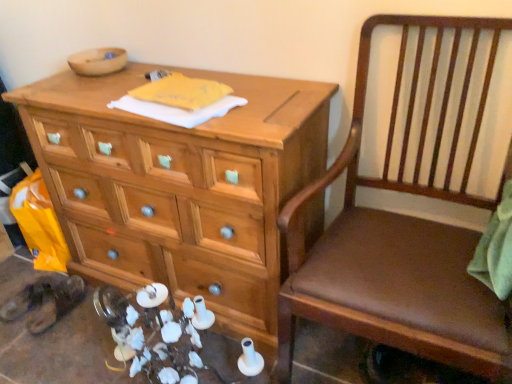
In order to face brown wood chair at right, should I rotate leftwards or rightwards?

Rotate your view right by about 20.165°.

What do you see at coordinates (384, 227) in the screenshot? I see `brown wood chair at right` at bounding box center [384, 227].

Where is `brown wood chair at right`? The width and height of the screenshot is (512, 384). brown wood chair at right is located at coordinates (384, 227).

Describe the element at coordinates (180, 187) in the screenshot. I see `natural wood chest of drawers at center` at that location.

Identify the location of natural wood chest of drawers at center. (x=180, y=187).

Identify the location of brown wood chair at right. (384, 227).

Is natural wood chest of drawers at center to the right of brown wood chair at right from the viewer's perspective?

Incorrect, natural wood chest of drawers at center is not on the right side of brown wood chair at right.

Does natural wood chest of drawers at center lie in front of brown wood chair at right?

That is False.

Which is less distant, [246,239] or [454,260]?

Point [454,260]

From the image's perspective, is natural wood chest of drawers at center located above or below brown wood chair at right?

natural wood chest of drawers at center is above brown wood chair at right.

From a real-world perspective, is natural wood chest of drawers at center located higher than brown wood chair at right?

No, from a real-world perspective, natural wood chest of drawers at center is not over brown wood chair at right

Considering the sizes of objects natural wood chest of drawers at center and brown wood chair at right in the image provided, who is thinner, natural wood chest of drawers at center or brown wood chair at right?

natural wood chest of drawers at center.

Does natural wood chest of drawers at center have a greater height compared to brown wood chair at right?

Incorrect, the height of natural wood chest of drawers at center is not larger of that of brown wood chair at right.

Based on their sizes in the image, would you say natural wood chest of drawers at center is bigger or smaller than brown wood chair at right?

Considering their sizes, natural wood chest of drawers at center takes up more space than brown wood chair at right.

Is natural wood chest of drawers at center positioned beyond the bounds of brown wood chair at right?

natural wood chest of drawers at center is positioned outside brown wood chair at right.

Looking at this image, is natural wood chest of drawers at center next to brown wood chair at right and touching it?

No, natural wood chest of drawers at center is not in contact with brown wood chair at right.

Is natural wood chest of drawers at center positioned with its back to brown wood chair at right?

No, natural wood chest of drawers at center's orientation is not away from brown wood chair at right.

How different are the orientations of natural wood chest of drawers at center and brown wood chair at right in degrees?

2.28e-05 degrees separate the facing orientations of natural wood chest of drawers at center and brown wood chair at right.

From the picture: How distant is natural wood chest of drawers at center from brown wood chair at right?

natural wood chest of drawers at center and brown wood chair at right are 16.39 inches apart.

This screenshot has width=512, height=384. Find the location of `chest of drawers that is on the left side of brown wood chair at right`. chest of drawers that is on the left side of brown wood chair at right is located at coordinates click(x=180, y=187).

Considering the positions of objects brown wood chair at right and natural wood chest of drawers at center in the image provided, who is more to the left, brown wood chair at right or natural wood chest of drawers at center?

From the viewer's perspective, natural wood chest of drawers at center appears more on the left side.

Which object is closer to the camera taking this photo, brown wood chair at right or natural wood chest of drawers at center?

Positioned in front is brown wood chair at right.

Does point (342, 246) come closer to viewer compared to point (88, 100)?

Yes, point (342, 246) is closer to viewer.

From the image's perspective, is brown wood chair at right over natural wood chest of drawers at center?

No, from the image's perspective, brown wood chair at right is not above natural wood chest of drawers at center.

Consider the image. From a real-world perspective, is brown wood chair at right located higher than natural wood chest of drawers at center?

Yes, from a real-world perspective, brown wood chair at right is above natural wood chest of drawers at center.

Looking at this image, between brown wood chair at right and natural wood chest of drawers at center, which one has smaller width?

With smaller width is natural wood chest of drawers at center.

Who is taller, brown wood chair at right or natural wood chest of drawers at center?

With more height is brown wood chair at right.

Is brown wood chair at right smaller than natural wood chest of drawers at center?

Indeed, brown wood chair at right has a smaller size compared to natural wood chest of drawers at center.

Would you say brown wood chair at right is outside natural wood chest of drawers at center?

Yes, brown wood chair at right is located beyond the bounds of natural wood chest of drawers at center.

Does brown wood chair at right touch natural wood chest of drawers at center?

No, brown wood chair at right is not in contact with natural wood chest of drawers at center.

Is brown wood chair at right positioned with its back to natural wood chest of drawers at center?

brown wood chair at right is not turned away from natural wood chest of drawers at center.

Looking at this image, how many degrees apart are the facing directions of brown wood chair at right and natural wood chest of drawers at center?

The angular difference between brown wood chair at right and natural wood chest of drawers at center is 2.28e-05 degrees.

Measure the distance from brown wood chair at right to natural wood chest of drawers at center.

16.39 inches.

This screenshot has height=384, width=512. I want to click on chest of drawers on the left of brown wood chair at right, so click(180, 187).

Where is `chair below the natural wood chest of drawers at center (from the image's perspective)`? chair below the natural wood chest of drawers at center (from the image's perspective) is located at coordinates (384, 227).

In order to click on chair that appears above the natural wood chest of drawers at center (from a real-world perspective) in this screenshot , I will do `click(384, 227)`.